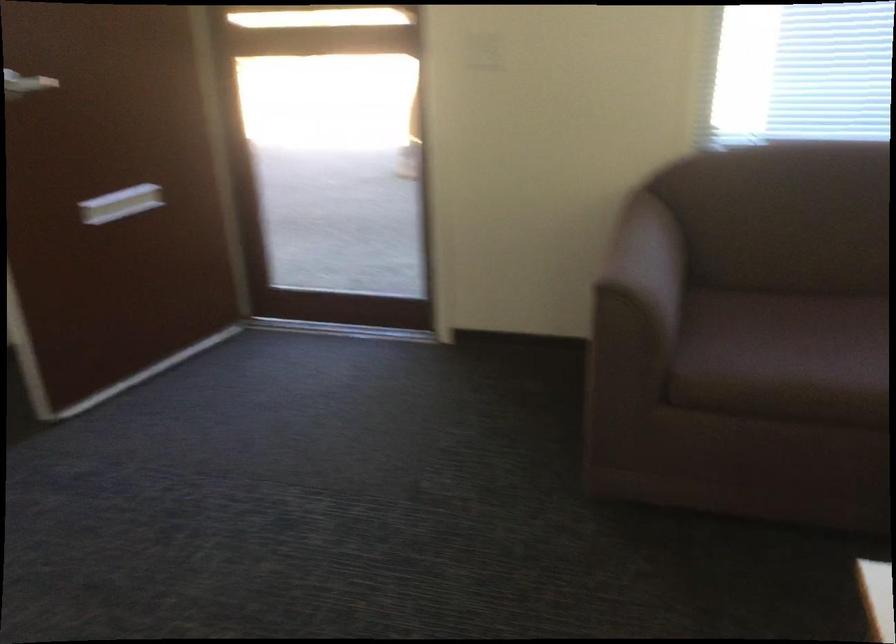
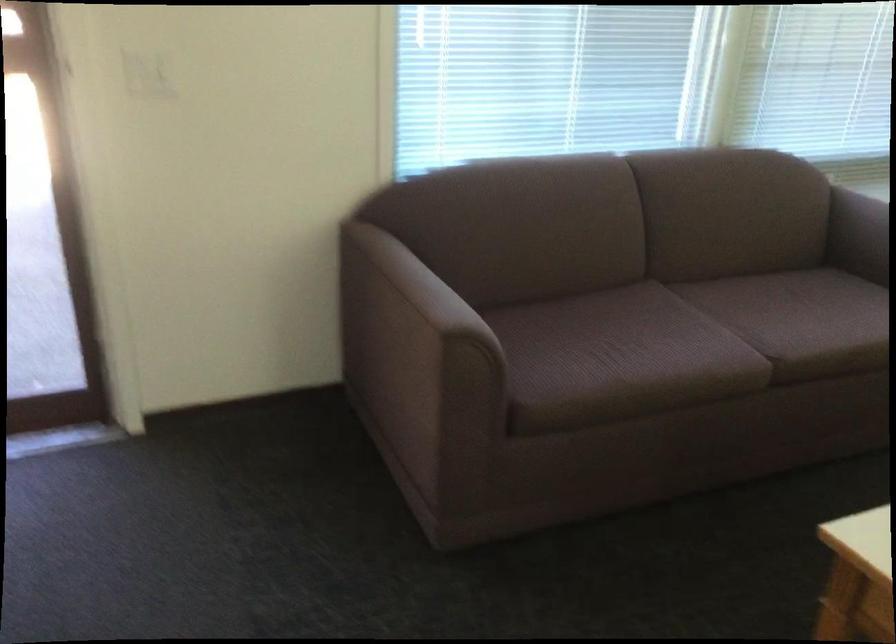
Question: The images are taken continuously from a first-person perspective. In which direction is your viewpoint rotating?

Choices:
 (A) Left
 (B) Right
 (C) Up
 (D) Down

Answer: (B)